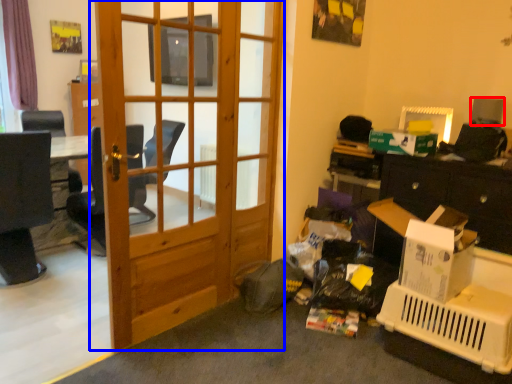
Question: Which object appears farthest to the camera in this image, loudspeaker (highlighted by a red box) or door (highlighted by a blue box)?

Choices:
 (A) loudspeaker
 (B) door

Answer: (A)